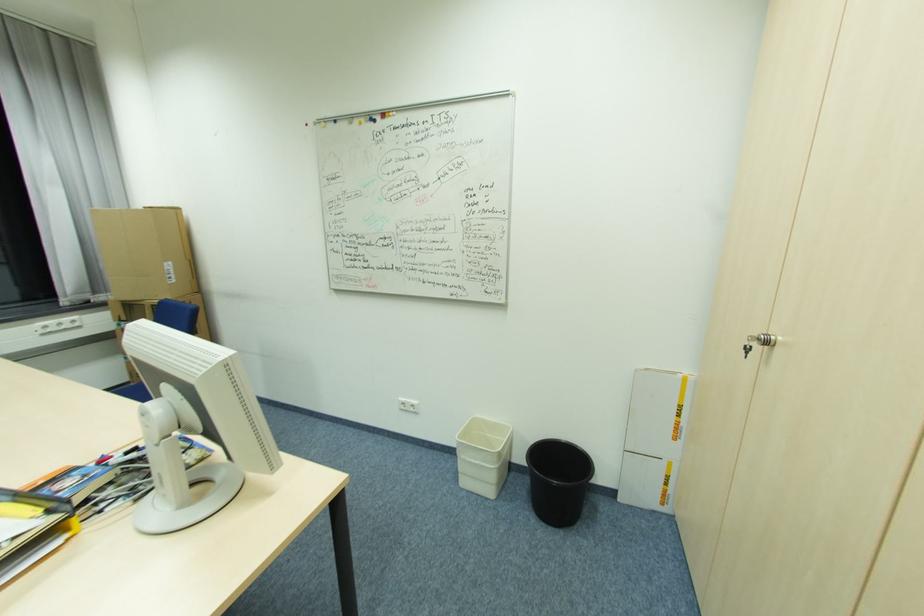
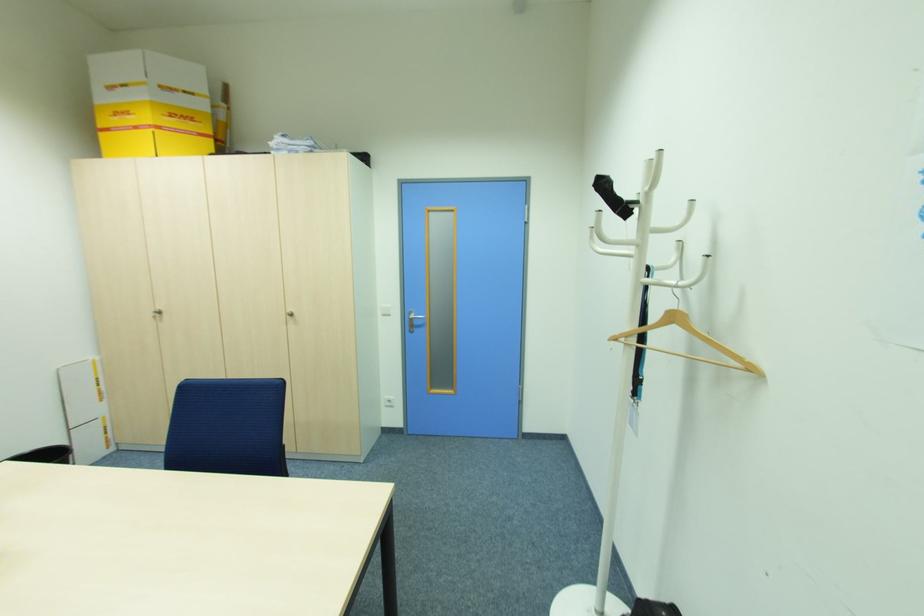
In the second image, find the point that corresponds to (x=772, y=344) in the first image.

(162, 312)